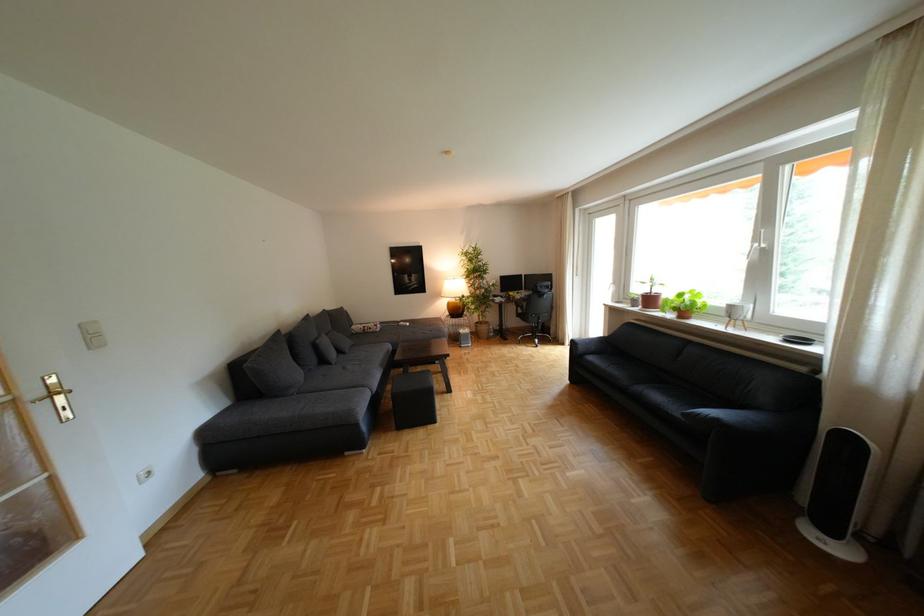
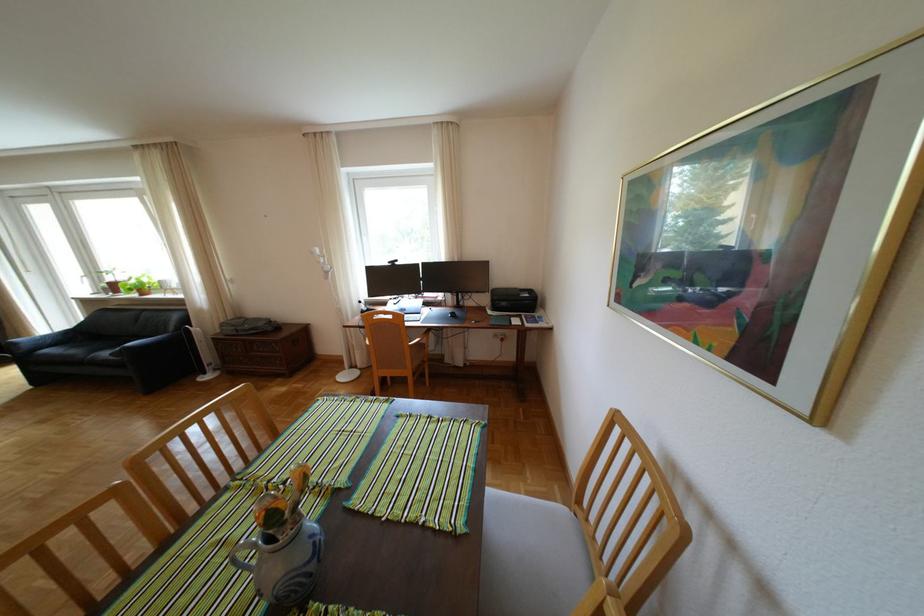
Find the pixel in the second image that matches (650,290) in the first image.

(123, 278)